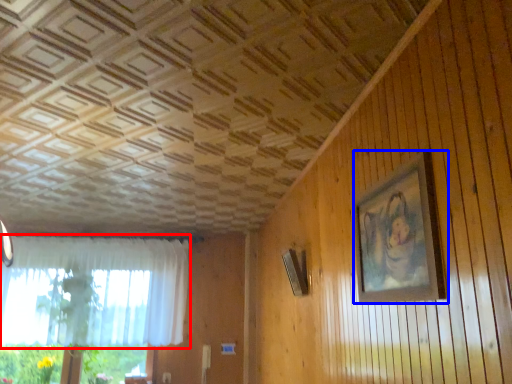
Question: Which object appears closest to the camera in this image, curtain (highlighted by a red box) or picture frame (highlighted by a blue box)?

Choices:
 (A) curtain
 (B) picture frame

Answer: (B)